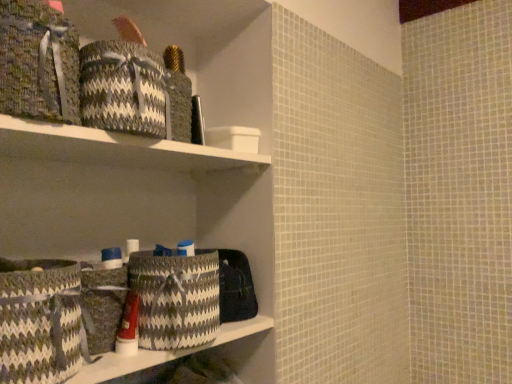
Question: Are textured woven basket at lower left and textured woven basket at lower left, the first basket positioned from the front, located far from each other?

Choices:
 (A) yes
 (B) no

Answer: (B)

Question: Would you say textured woven basket at lower left is outside textured woven basket at lower left, placed as the 2th basket when sorted from back to front?

Choices:
 (A) yes
 (B) no

Answer: (A)

Question: From the image's perspective, would you say textured woven basket at lower left is positioned over textured woven basket at lower left, placed as the 2th basket when sorted from back to front?

Choices:
 (A) no
 (B) yes

Answer: (A)

Question: Considering the relative positions of textured woven basket at lower left and textured woven basket at lower left, placed as the 2th basket when sorted from back to front, in the image provided, is textured woven basket at lower left behind textured woven basket at lower left, placed as the 2th basket when sorted from back to front,?

Choices:
 (A) no
 (B) yes

Answer: (B)

Question: From the image's perspective, would you say textured woven basket at lower left is shown under textured woven basket at lower left, the first basket positioned from the front?

Choices:
 (A) yes
 (B) no

Answer: (A)

Question: From a real-world perspective, is textured woven basket at lower left positioned under textured woven basket at lower left, placed as the 2th basket when sorted from back to front, based on gravity?

Choices:
 (A) no
 (B) yes

Answer: (B)

Question: Are black and white woven basket at upper left, marked as the second material in a left-to-right arrangement, and textured woven basket at lower left far apart?

Choices:
 (A) no
 (B) yes

Answer: (A)

Question: From a real-world perspective, is black and white woven basket at upper left, which ranks as the first material in right-to-left order, positioned over textured woven basket at lower left based on gravity?

Choices:
 (A) no
 (B) yes

Answer: (B)

Question: Can you confirm if black and white woven basket at upper left, which ranks as the first material in right-to-left order, is bigger than textured woven basket at lower left?

Choices:
 (A) no
 (B) yes

Answer: (B)

Question: Is black and white woven basket at upper left, which ranks as the first material in right-to-left order, positioned with its back to textured woven basket at lower left?

Choices:
 (A) no
 (B) yes

Answer: (A)

Question: Is black and white woven basket at upper left, which ranks as the first material in right-to-left order, thinner than textured woven basket at lower left?

Choices:
 (A) no
 (B) yes

Answer: (B)

Question: Considering the relative sizes of black and white woven basket at upper left, which ranks as the first material in right-to-left order, and textured woven basket at lower left in the image provided, is black and white woven basket at upper left, which ranks as the first material in right-to-left order, wider than textured woven basket at lower left?

Choices:
 (A) no
 (B) yes

Answer: (A)

Question: Considering the relative positions of woven fabric basket at upper left, acting as the 2th material starting from the right, and textured woven laundry basket at center in the image provided, is woven fabric basket at upper left, acting as the 2th material starting from the right, in front of textured woven laundry basket at center?

Choices:
 (A) no
 (B) yes

Answer: (B)